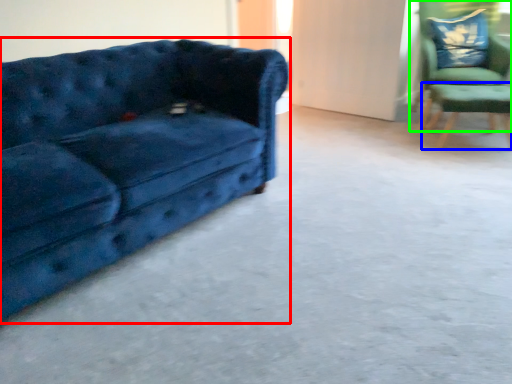
Question: Which object is the farthest from studio couch (highlighted by a red box)? Choose among these: side table (highlighted by a blue box) or chair (highlighted by a green box).

Choices:
 (A) side table
 (B) chair

Answer: (B)